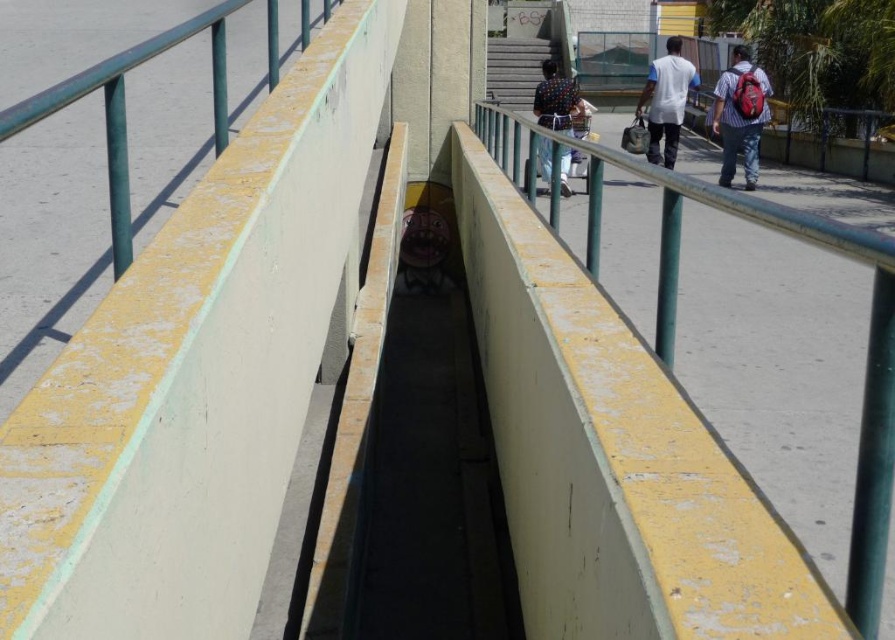
You are standing at the point with coordinates (865, 355) on the concrete structure. What object are you standing on?

The point (865, 355) corresponds to the yellow painted metal rail at center.

You are standing at the entrance of the tunnel in the image. You see a striped cotton shirt at right and a polka dot shirt at center. Which shirt is closer to you?

The striped cotton shirt at right is closer to you because the polka dot shirt at center is behind it.